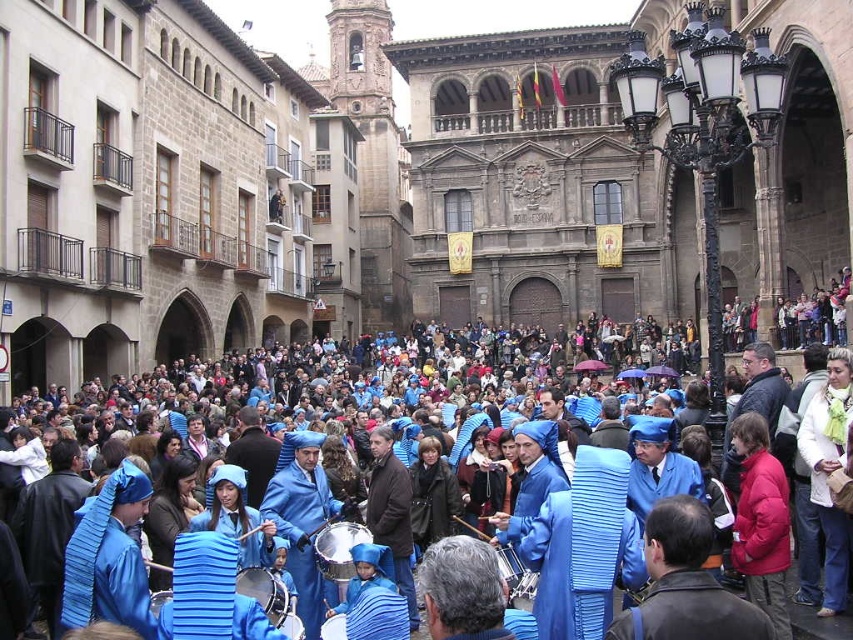
How distant is blue striped fabric at center from shiny silver drum at center?

They are 59.76 feet apart.

Is blue striped fabric at center shorter than shiny silver drum at center?

No, blue striped fabric at center is not shorter than shiny silver drum at center.

Is point (543, 372) positioned after point (329, 545)?

Yes, it is behind point (329, 545).

The width and height of the screenshot is (853, 640). In order to click on blue striped fabric at center in this screenshot , I will do `click(318, 396)`.

Between shiny silver drum at center and metallic drum at center, which one appears on the right side from the viewer's perspective?

From the viewer's perspective, metallic drum at center appears more on the right side.

Does point (341, 529) lie behind point (526, 579)?

Yes.

Identify the location of shiny silver drum at center. The height and width of the screenshot is (640, 853). (338, 548).

Where is `shiny silver drum at center`? This screenshot has height=640, width=853. shiny silver drum at center is located at coordinates [x=338, y=548].

In the scene shown: Who is more distant from viewer, (334, 404) or (500, 556)?

Point (334, 404)

Does blue striped fabric at center have a lesser width compared to metallic drum at center?

No, blue striped fabric at center is not thinner than metallic drum at center.

Which is behind, point (338, 444) or point (532, 588)?

Point (338, 444)

Locate an element on the screen. The image size is (853, 640). blue striped fabric at center is located at coordinates point(318,396).